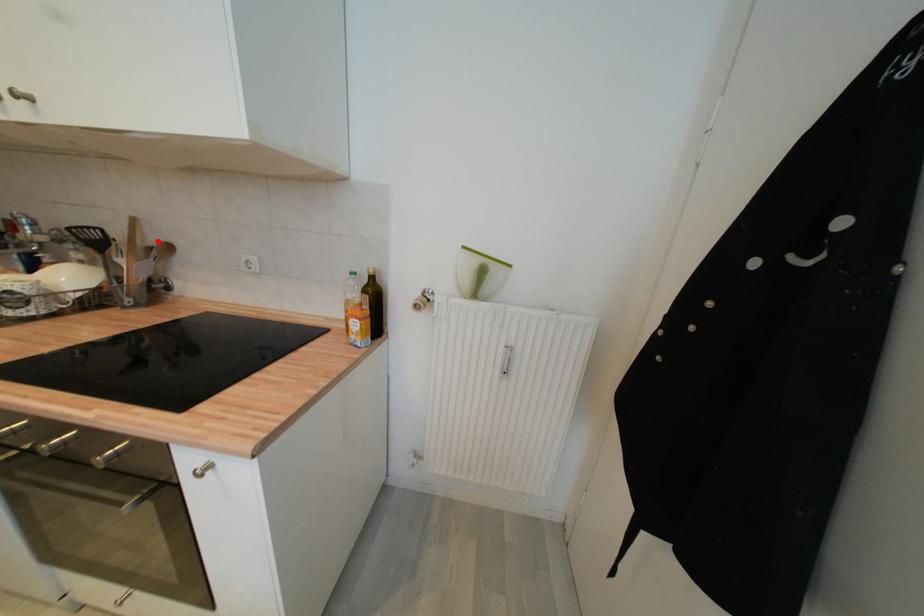
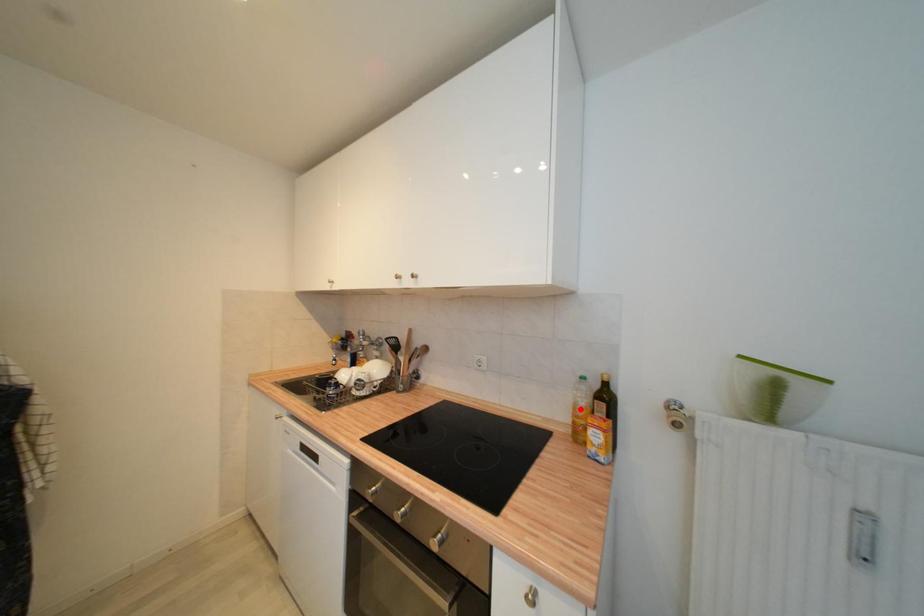
I am providing you with two images of the same scene from different viewpoints. A red point is marked on the first image and another point is marked on the second image. Is the red point in image1 aligned with the point shown in image2?

No